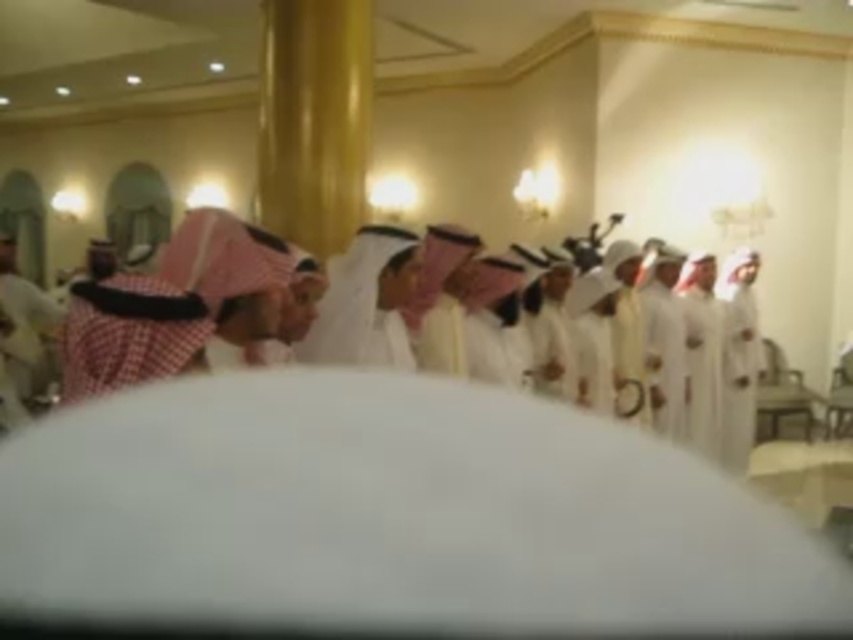
Question: Can you confirm if white cotton robe at right is thinner than white matte robe at right?

Choices:
 (A) yes
 (B) no

Answer: (A)

Question: Considering the relative positions of white cotton robe at right and white matte robe at right in the image provided, where is white cotton robe at right located with respect to white matte robe at right?

Choices:
 (A) above
 (B) below

Answer: (B)

Question: Is white cotton robe at right below white matte robe at right?

Choices:
 (A) yes
 (B) no

Answer: (A)

Question: Which of the following is the farthest from the observer?

Choices:
 (A) white matte robe at right
 (B) white cotton robe at right

Answer: (B)

Question: Among these points, which one is farthest from the camera?

Choices:
 (A) (751, 438)
 (B) (720, 440)

Answer: (A)